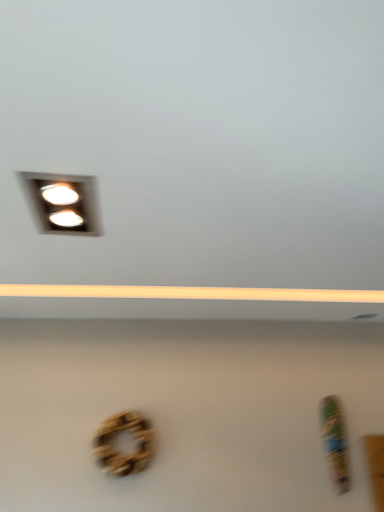
Question: Is wooden wreath at center positioned behind matte white recessed lights at upper left?

Choices:
 (A) yes
 (B) no

Answer: (A)

Question: Does wooden wreath at center appear on the right side of matte white recessed lights at upper left?

Choices:
 (A) no
 (B) yes

Answer: (B)

Question: Considering the relative sizes of wooden wreath at center and matte white recessed lights at upper left in the image provided, is wooden wreath at center thinner than matte white recessed lights at upper left?

Choices:
 (A) no
 (B) yes

Answer: (B)

Question: From a real-world perspective, does wooden wreath at center sit lower than matte white recessed lights at upper left?

Choices:
 (A) yes
 (B) no

Answer: (A)

Question: Is the surface of wooden wreath at center in direct contact with matte white recessed lights at upper left?

Choices:
 (A) no
 (B) yes

Answer: (A)

Question: Is wooden wreath at center taller than matte white recessed lights at upper left?

Choices:
 (A) yes
 (B) no

Answer: (A)

Question: Is matte white recessed lights at upper left taller than wooden wreath at center?

Choices:
 (A) no
 (B) yes

Answer: (A)

Question: From the image's perspective, does matte white recessed lights at upper left appear lower than wooden wreath at center?

Choices:
 (A) yes
 (B) no

Answer: (B)

Question: Is matte white recessed lights at upper left bigger than wooden wreath at center?

Choices:
 (A) yes
 (B) no

Answer: (B)

Question: Is matte white recessed lights at upper left in contact with wooden wreath at center?

Choices:
 (A) no
 (B) yes

Answer: (A)

Question: Can you confirm if matte white recessed lights at upper left is smaller than wooden wreath at center?

Choices:
 (A) yes
 (B) no

Answer: (A)

Question: Is matte white recessed lights at upper left aimed at wooden wreath at center?

Choices:
 (A) yes
 (B) no

Answer: (B)

Question: From a real-world perspective, is wooden wreath at center positioned above or below matte white recessed lights at upper left?

Choices:
 (A) below
 (B) above

Answer: (A)